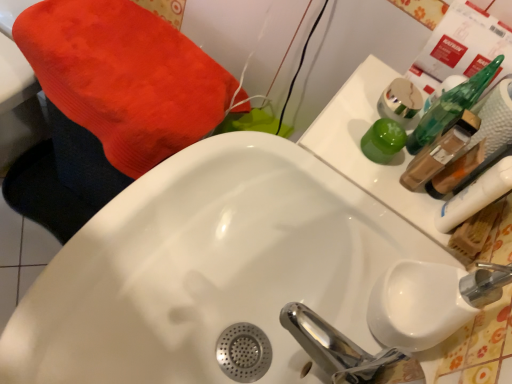
At what (x,y) coordinates should I click in order to perform the action: click on free location in front of metallic gold mouthwash at upper right, marked as the first mouthwash in a top-to-bottom arrangement. Please return your answer as a coordinate pair (x, y). The width and height of the screenshot is (512, 384). Looking at the image, I should click on (362, 171).